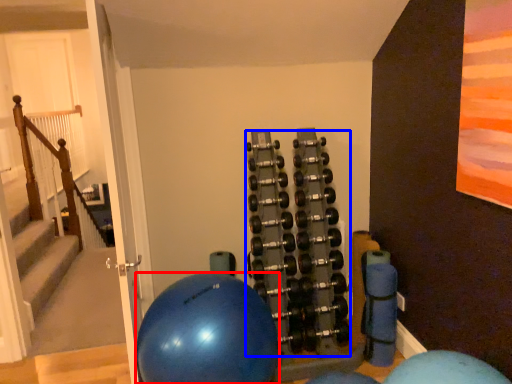
Question: Which object appears farthest to the camera in this image, ball (highlighted by a red box) or dumbbell (highlighted by a blue box)?

Choices:
 (A) ball
 (B) dumbbell

Answer: (B)